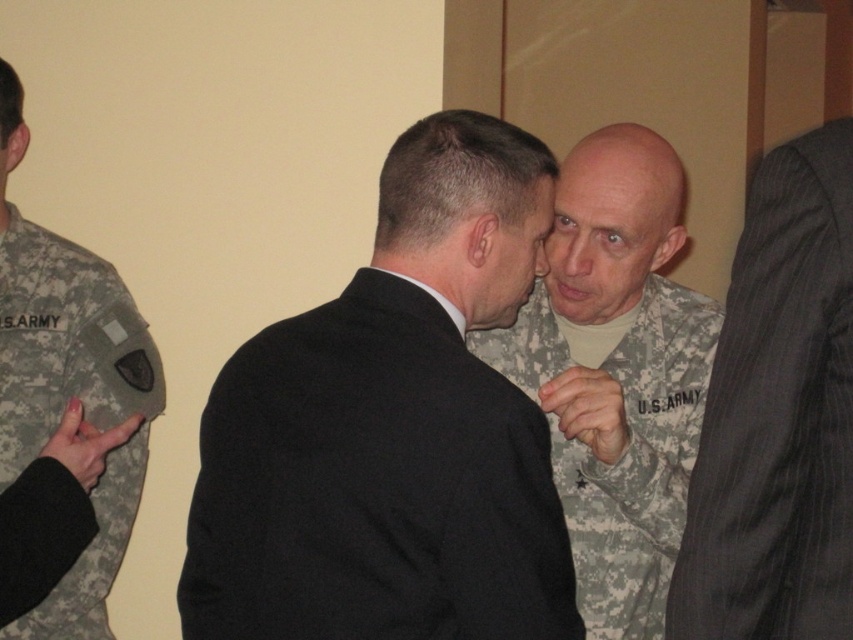
You are standing in the room and want to hand a document to the person wearing the black pinstripe suit at right. If your arm can reach 35 inches, can you reach them without moving?

The black pinstripe suit at right is 36.70 inches away from the viewer, so your arm can only reach 35 inches. You cannot reach them without moving closer.

You are an interior designer planning to place a 2.5 meter wide sofa in this room. The sofa must be placed between the black pinstripe suit at right and the camouflage fabric us army uniform at center. Given their widths, will the sofa fit between them?

The black pinstripe suit at right has a lesser width compared to camouflage fabric us army uniform at center. Therefore, the total width between them may not accommodate a 2.5 meter wide sofa. Check the actual distance between the two objects first.